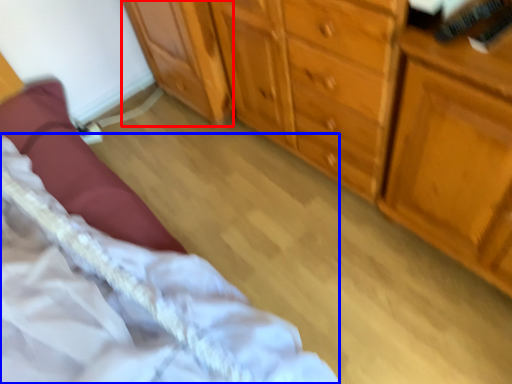
Question: Which object is further to the camera taking this photo, cabinetry (highlighted by a red box) or bed (highlighted by a blue box)?

Choices:
 (A) cabinetry
 (B) bed

Answer: (A)